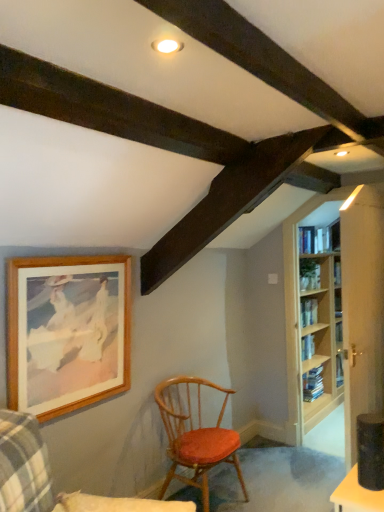
Question: Which direction should I rotate to look at wooden chair with red cushion at center, acting as the 2th chair starting from the front?

Choices:
 (A) right
 (B) left

Answer: (A)

Question: Considering the relative sizes of wooden picture frame at upper left and wooden chair with red cushion at center, the first chair from the back, in the image provided, is wooden picture frame at upper left smaller than wooden chair with red cushion at center, the first chair from the back,?

Choices:
 (A) no
 (B) yes

Answer: (B)

Question: Is wooden chair with red cushion at center, acting as the 2th chair starting from the front, completely or partially inside wooden picture frame at upper left?

Choices:
 (A) no
 (B) yes

Answer: (A)

Question: Does wooden picture frame at upper left have a lesser height compared to wooden chair with red cushion at center, the first chair from the back?

Choices:
 (A) no
 (B) yes

Answer: (A)

Question: From the image's perspective, does wooden picture frame at upper left appear higher than wooden chair with red cushion at center, the first chair from the back?

Choices:
 (A) no
 (B) yes

Answer: (B)

Question: Is wooden picture frame at upper left at the right side of wooden chair with red cushion at center, the first chair from the back?

Choices:
 (A) yes
 (B) no

Answer: (B)

Question: Considering the relative sizes of wooden picture frame at upper left and wooden chair with red cushion at center, acting as the 2th chair starting from the front, in the image provided, is wooden picture frame at upper left wider than wooden chair with red cushion at center, acting as the 2th chair starting from the front,?

Choices:
 (A) yes
 (B) no

Answer: (B)

Question: Is the depth of wooden chair with red cushion at center, acting as the 2th chair starting from the front, less than that of wooden picture frame at upper left?

Choices:
 (A) no
 (B) yes

Answer: (A)

Question: Is wooden chair with red cushion at center, the first chair from the back, further to the viewer compared to wooden picture frame at upper left?

Choices:
 (A) no
 (B) yes

Answer: (B)

Question: From the image's perspective, does wooden chair with red cushion at center, the first chair from the back, appear lower than wooden picture frame at upper left?

Choices:
 (A) no
 (B) yes

Answer: (B)

Question: Is wooden chair with red cushion at center, the first chair from the back, to the left of wooden picture frame at upper left from the viewer's perspective?

Choices:
 (A) no
 (B) yes

Answer: (A)

Question: Is wooden picture frame at upper left at the back of wooden chair with red cushion at center, the first chair from the back?

Choices:
 (A) yes
 (B) no

Answer: (B)

Question: From a real-world perspective, is wooden chair with red cushion at center, the first chair from the back, on top of wooden picture frame at upper left?

Choices:
 (A) yes
 (B) no

Answer: (B)

Question: From a real-world perspective, is wooden chair with red cushion at center, the first chair from the front, under light wood bookcase at right?

Choices:
 (A) no
 (B) yes

Answer: (B)